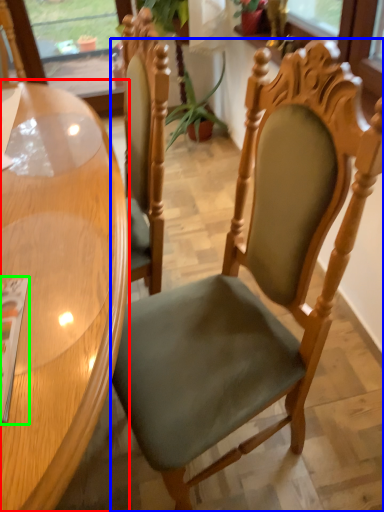
Question: Which object is the closest to the table (highlighted by a red box)? Choose among these: chair (highlighted by a blue box) or magazine (highlighted by a green box).

Choices:
 (A) chair
 (B) magazine

Answer: (B)